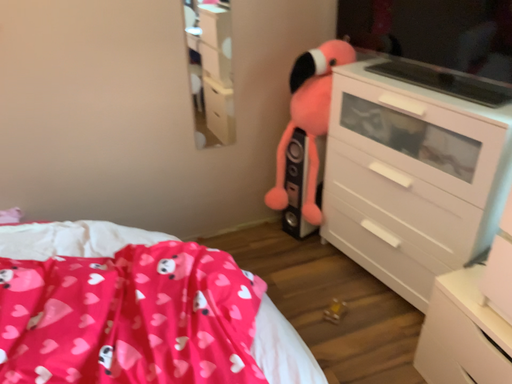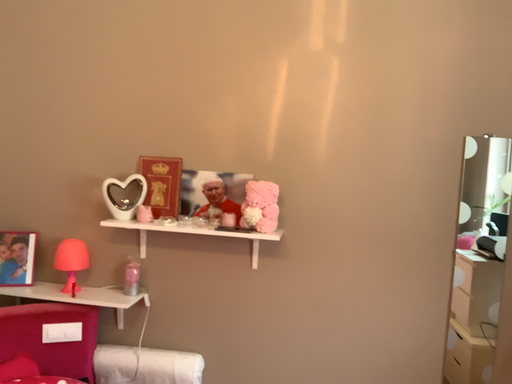
Question: How did the camera likely rotate when shooting the video?

Choices:
 (A) rotated upward
 (B) rotated downward

Answer: (A)